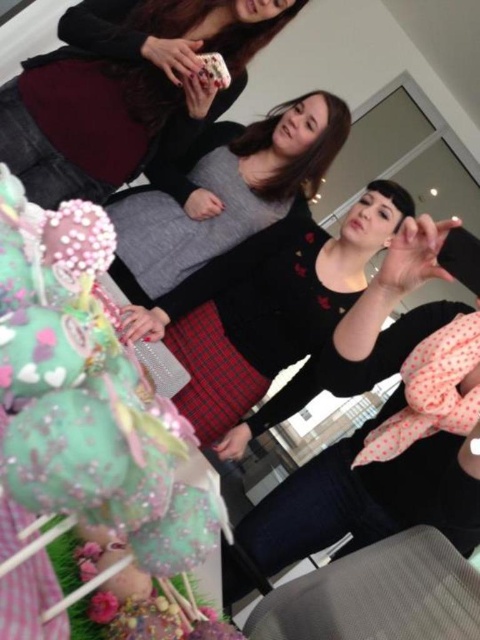
Does matte black phone at upper center have a greater width compared to black matte dress at center?

Yes.

Does matte black phone at upper center appear on the right side of black matte dress at center?

No, matte black phone at upper center is not to the right of black matte dress at center.

At what (x,y) coordinates should I click in order to perform the action: click on matte black phone at upper center. Please return your answer as a coordinate pair (x, y). Looking at the image, I should click on (127, 90).

Consider the image. Is matte black phone at upper center bigger than pink dotted fabric at center?

No, matte black phone at upper center is not bigger than pink dotted fabric at center.

Is point (107, 189) farther from camera compared to point (247, 538)?

Yes.

Which is in front, point (27, 74) or point (408, 323)?

Positioned in front is point (408, 323).

The height and width of the screenshot is (640, 480). Identify the location of matte black phone at upper center. (127, 90).

Based on the photo, between pink dotted fabric at center and black matte dress at center, which one is positioned lower?

pink dotted fabric at center

At what (x,y) coordinates should I click in order to perform the action: click on pink dotted fabric at center. Please return your answer as a coordinate pair (x, y). This screenshot has width=480, height=640. Looking at the image, I should click on (x=368, y=497).